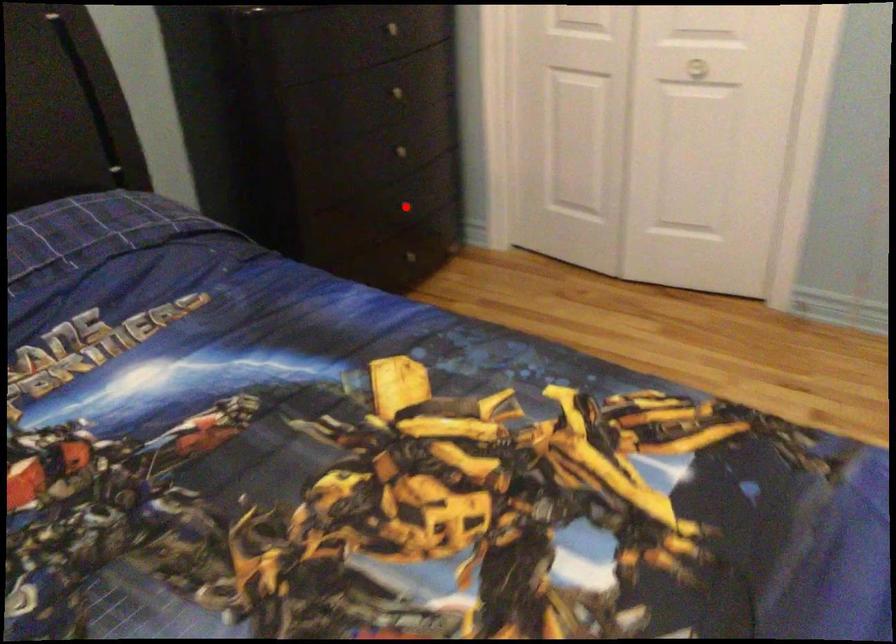
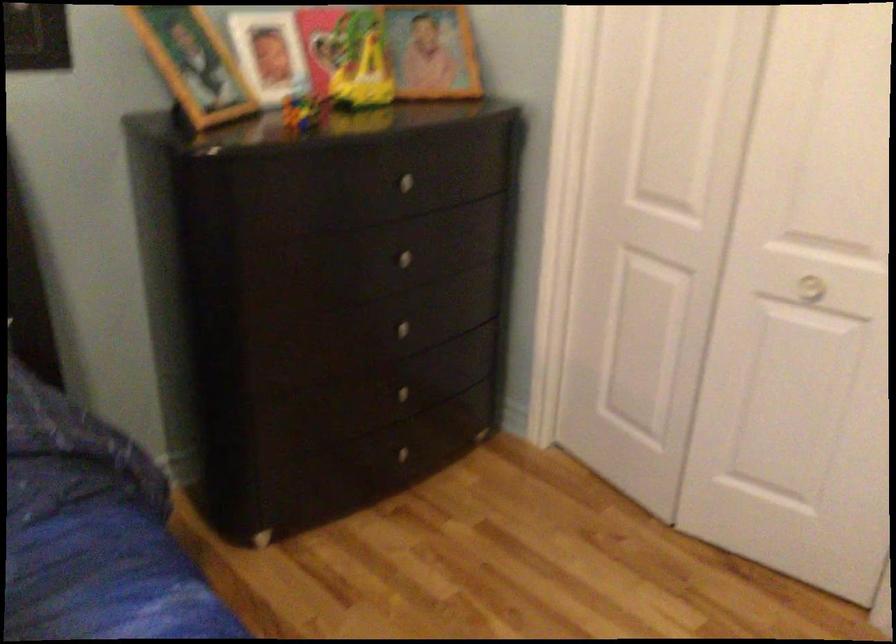
Question: I am providing you with two images of the same scene from different viewpoints. In image1, a red point is highlighted. Considering the same 3D point in image2, which of the following is correct?

Choices:
 (A) It is closer
 (B) It is farther

Answer: (A)